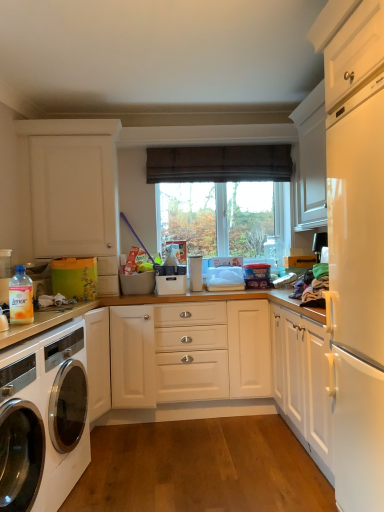
Question: Does transparent glass window at center have a greater width compared to white glossy washing machine at lower left?

Choices:
 (A) no
 (B) yes

Answer: (A)

Question: Considering the relative sizes of transparent glass window at center and white glossy washing machine at lower left in the image provided, is transparent glass window at center shorter than white glossy washing machine at lower left?

Choices:
 (A) yes
 (B) no

Answer: (A)

Question: Considering the relative positions of transparent glass window at center and white glossy washing machine at lower left in the image provided, is transparent glass window at center to the left of white glossy washing machine at lower left from the viewer's perspective?

Choices:
 (A) yes
 (B) no

Answer: (B)

Question: Is transparent glass window at center outside white glossy washing machine at lower left?

Choices:
 (A) yes
 (B) no

Answer: (A)

Question: Does transparent glass window at center turn towards white glossy washing machine at lower left?

Choices:
 (A) no
 (B) yes

Answer: (A)

Question: Visually, is white plastic container at center positioned to the left or to the right of white matte cabinet at upper left?

Choices:
 (A) left
 (B) right

Answer: (B)

Question: From the image's perspective, is white plastic container at center above or below white matte cabinet at upper left?

Choices:
 (A) above
 (B) below

Answer: (B)

Question: Considering the positions of white plastic container at center and white matte cabinet at upper left in the image, is white plastic container at center wider or thinner than white matte cabinet at upper left?

Choices:
 (A) wide
 (B) thin

Answer: (B)

Question: Choose the correct answer: Is white plastic container at center inside white matte cabinet at upper left or outside it?

Choices:
 (A) inside
 (B) outside

Answer: (B)

Question: Is white plastic container at center spatially inside white glossy washing machine at lower left, or outside of it?

Choices:
 (A) outside
 (B) inside

Answer: (A)

Question: From the image's perspective, is white plastic container at center located above or below white glossy washing machine at lower left?

Choices:
 (A) above
 (B) below

Answer: (A)

Question: Looking at their shapes, would you say white plastic container at center is wider or thinner than white glossy washing machine at lower left?

Choices:
 (A) wide
 (B) thin

Answer: (B)

Question: From a real-world perspective, is white plastic container at center positioned above or below white glossy washing machine at lower left?

Choices:
 (A) below
 (B) above

Answer: (B)

Question: Considering the positions of brown fabric curtain at center and white glossy washing machine at lower left in the image, is brown fabric curtain at center bigger or smaller than white glossy washing machine at lower left?

Choices:
 (A) small
 (B) big

Answer: (A)

Question: From a real-world perspective, is brown fabric curtain at center positioned above or below white glossy washing machine at lower left?

Choices:
 (A) above
 (B) below

Answer: (A)